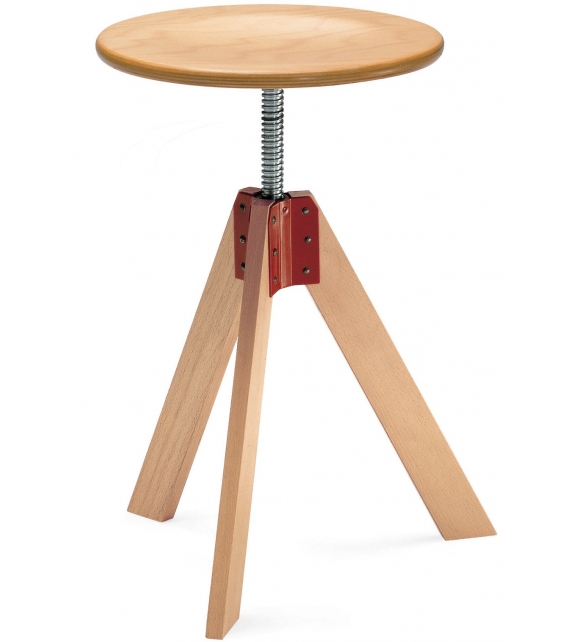
I want to click on table, so click(x=200, y=56).